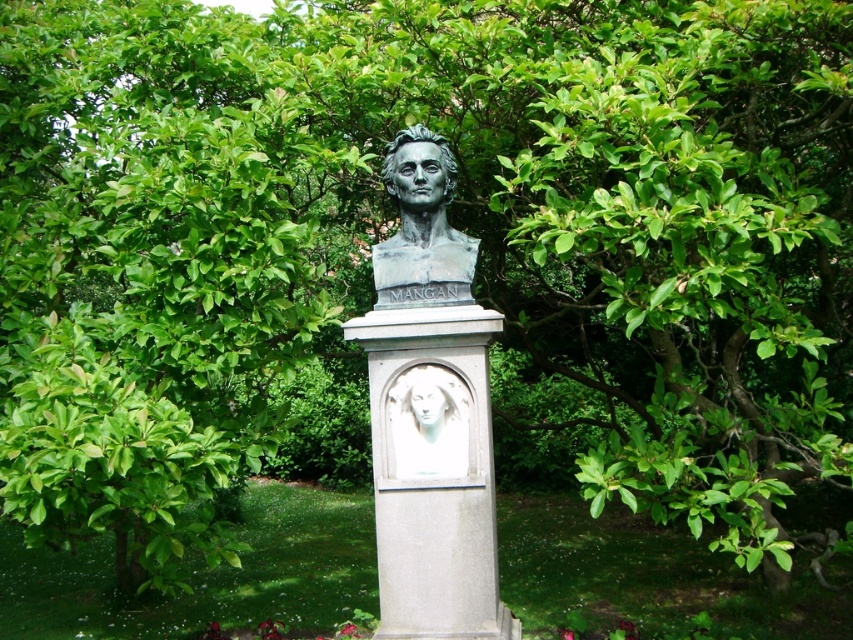
Question: Where is bronze bust at center located in relation to white marble relief at center in the image?

Choices:
 (A) left
 (B) right

Answer: (A)

Question: Does bronze bust at center appear on the right side of white marble relief at center?

Choices:
 (A) no
 (B) yes

Answer: (A)

Question: Which object appears farthest from the camera in this image?

Choices:
 (A) white marble relief at center
 (B) bronze bust at center

Answer: (B)

Question: Can you confirm if bronze bust at center is bigger than white marble relief at center?

Choices:
 (A) no
 (B) yes

Answer: (B)